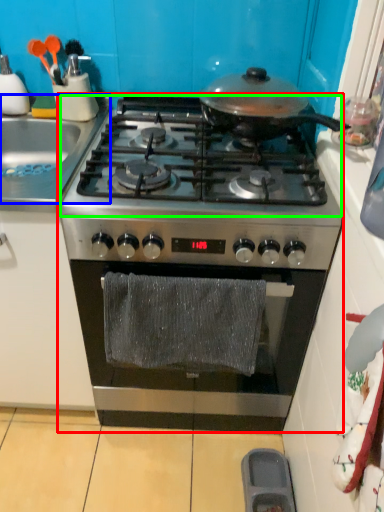
Question: Which object is positioned closest to gas stove (highlighted by a red box)? Select from sink (highlighted by a blue box) and gas stove (highlighted by a green box).

Choices:
 (A) sink
 (B) gas stove

Answer: (B)